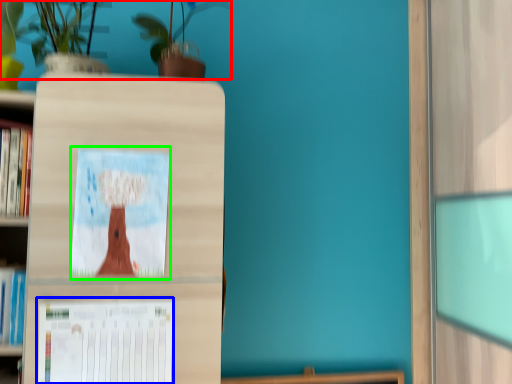
Question: Based on their relative distances, which object is nearer to floral arrangement (highlighted by a red box)? Choose from paperback book (highlighted by a blue box) and picture frame (highlighted by a green box).

Choices:
 (A) paperback book
 (B) picture frame

Answer: (B)